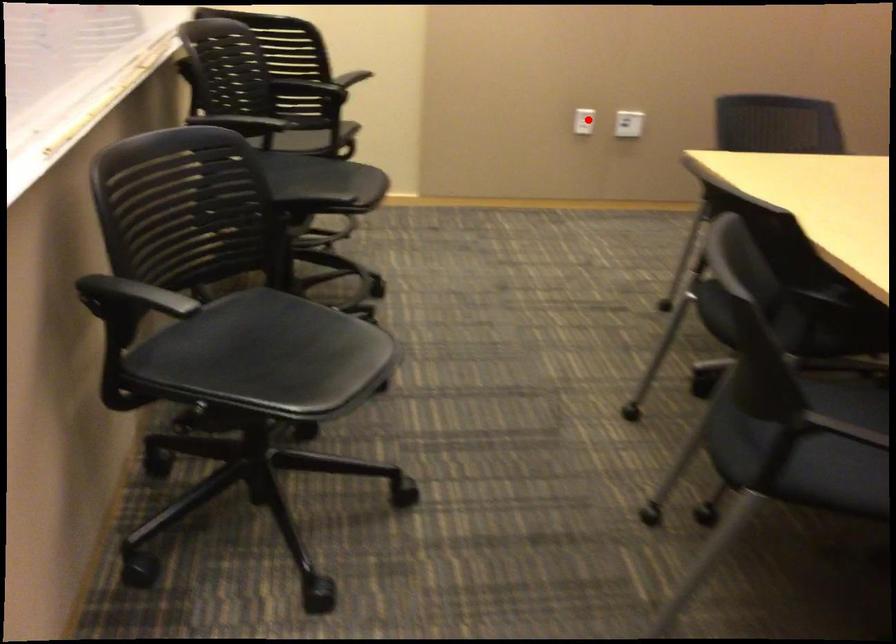
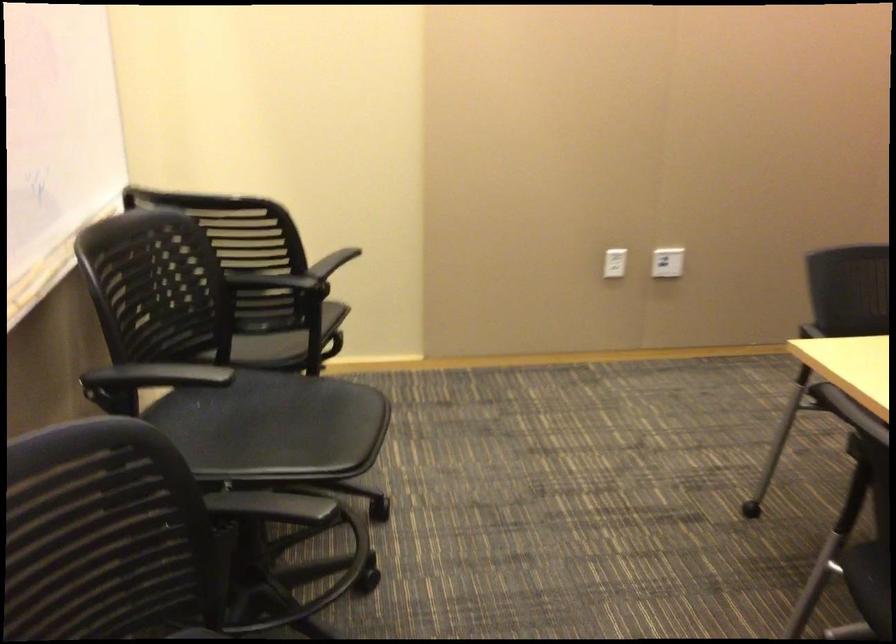
Locate, in the second image, the point that corresponds to the highlighted location in the first image.

(615, 263)